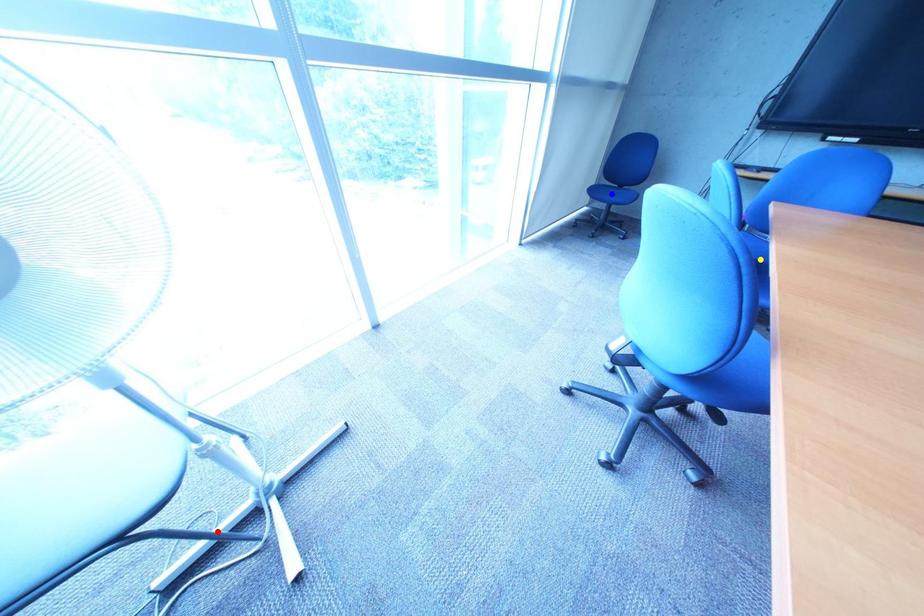
Order these from nearest to farthest:
A) red point
B) blue point
C) yellow point

1. yellow point
2. red point
3. blue point